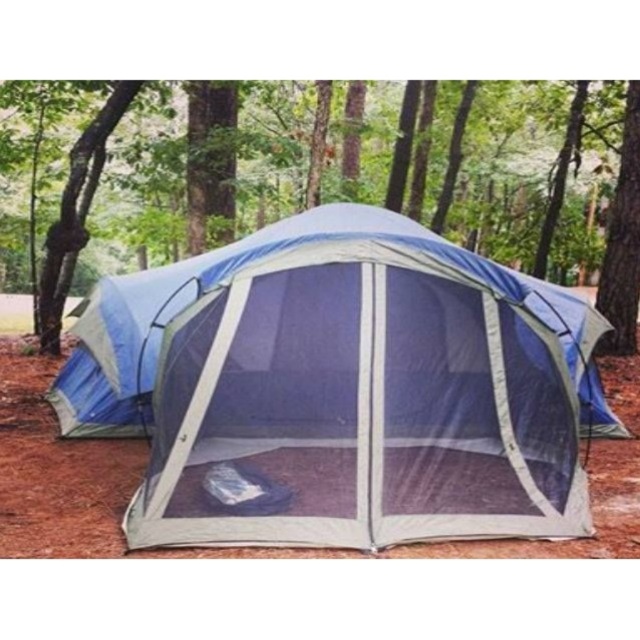
Question: Does blue mesh tent at center have a larger size compared to brown rough bark tree at right?

Choices:
 (A) yes
 (B) no

Answer: (A)

Question: Which of the following is the closest to the observer?

Choices:
 (A) green textured bark at center
 (B) blue mesh tent at center

Answer: (B)

Question: Based on their relative distances, which object is nearer to the blue mesh tent at center?

Choices:
 (A) brown rough bark tree at right
 (B) green textured bark at center

Answer: (A)

Question: Does blue mesh tent at center have a greater width compared to brown rough bark tree at right?

Choices:
 (A) no
 (B) yes

Answer: (B)

Question: In this image, where is green textured bark at center located relative to brown rough bark tree at right?

Choices:
 (A) above
 (B) below

Answer: (A)

Question: Estimate the real-world distances between objects in this image. Which object is farther from the blue mesh tent at center?

Choices:
 (A) brown rough bark tree at right
 (B) green textured bark at center

Answer: (B)